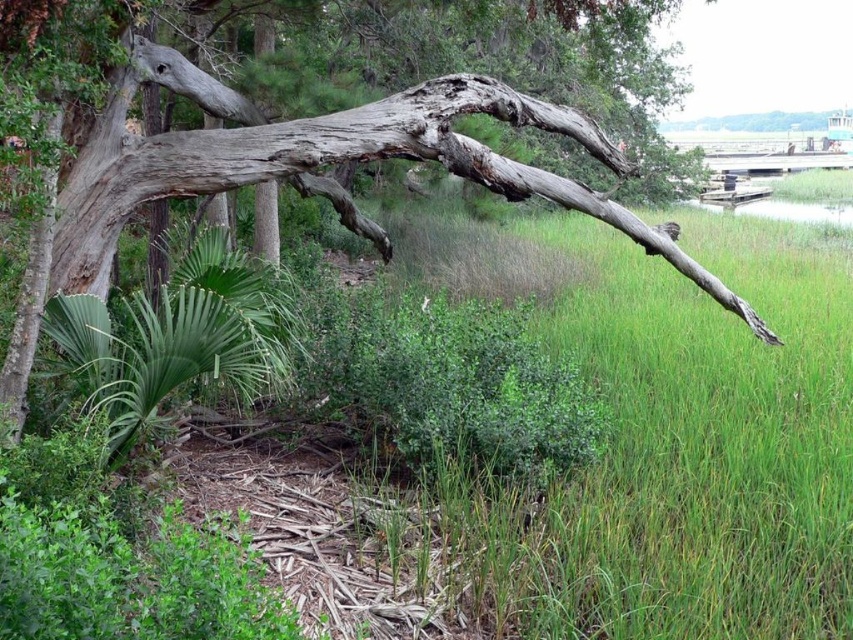
Looking at this image, does gray rough bark tree at upper left come in front of green leafy plant at lower left?

No, it is not.

Between gray rough bark tree at upper left and green leafy plant at lower left, which one appears on the right side from the viewer's perspective?

gray rough bark tree at upper left

Is point (13, 403) farther from viewer compared to point (166, 305)?

No, it is in front of (166, 305).

This screenshot has height=640, width=853. I want to click on gray rough bark tree at upper left, so click(289, 177).